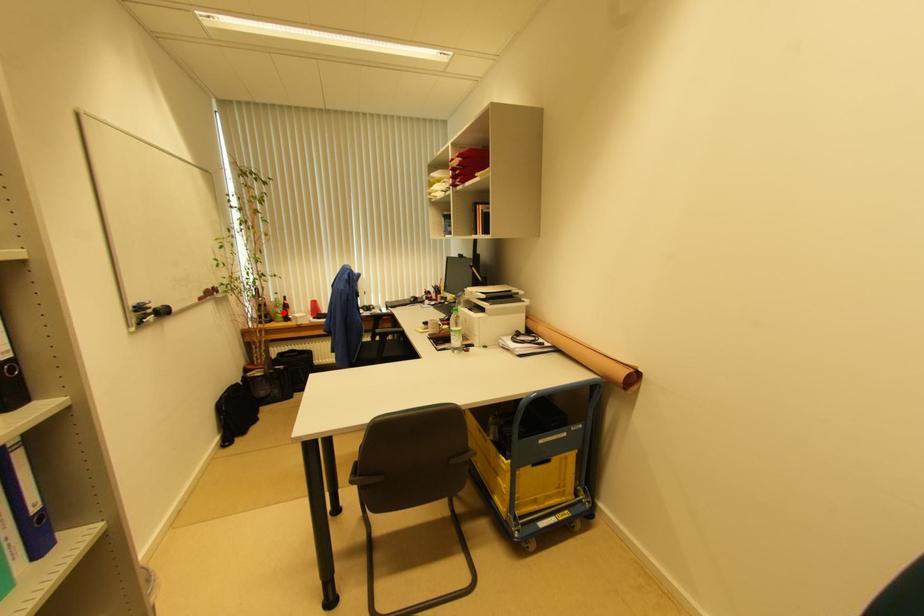
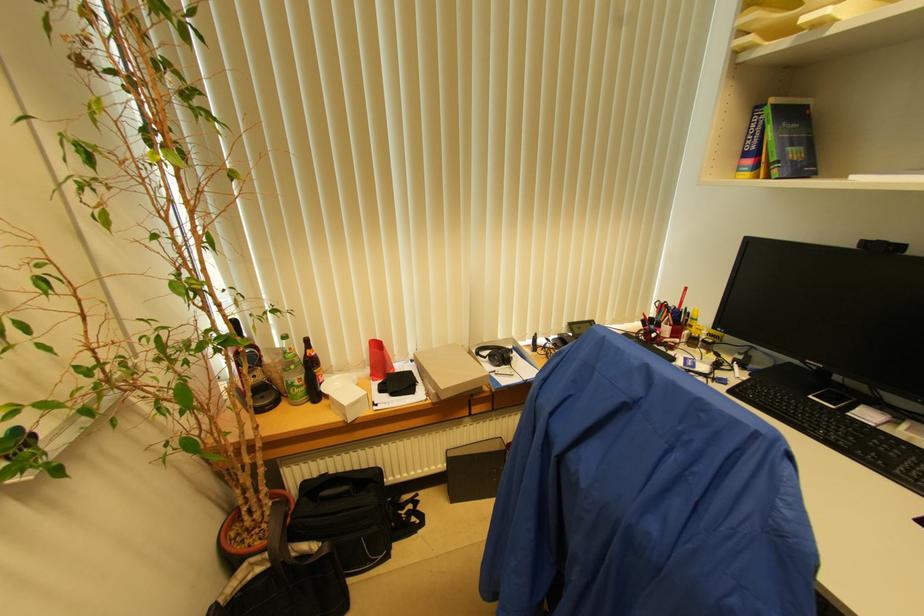
Where in the second image is the point corresponding to the highlighted location from the first image?

(304, 379)